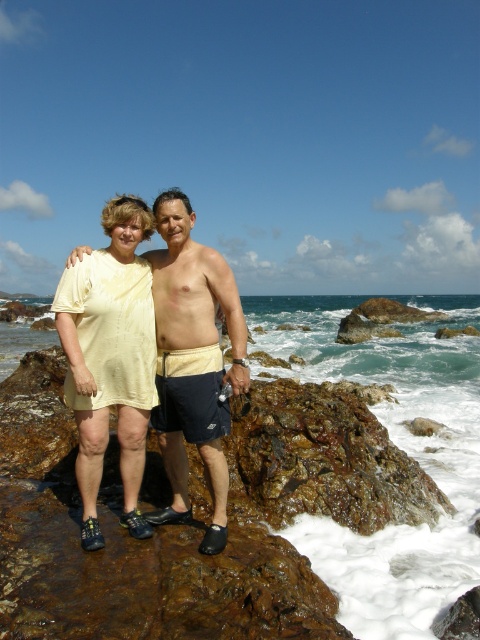
Question: Which is nearer to the clear blue water at center?

Choices:
 (A) beige cotton shirt at center
 (B) matte yellow dress at center

Answer: (A)

Question: Which point is closer to the camera?

Choices:
 (A) beige cotton shirt at center
 (B) matte yellow dress at center

Answer: (B)

Question: Can you confirm if clear blue water at center is thinner than matte yellow dress at center?

Choices:
 (A) yes
 (B) no

Answer: (B)

Question: Which of the following is the farthest from the observer?

Choices:
 (A) (305, 356)
 (B) (126, 490)
 (C) (232, 288)

Answer: (A)

Question: Can you confirm if matte yellow dress at center is wider than beige cotton shirt at center?

Choices:
 (A) no
 (B) yes

Answer: (A)

Question: Is clear blue water at center bigger than beige cotton shirt at center?

Choices:
 (A) no
 (B) yes

Answer: (B)